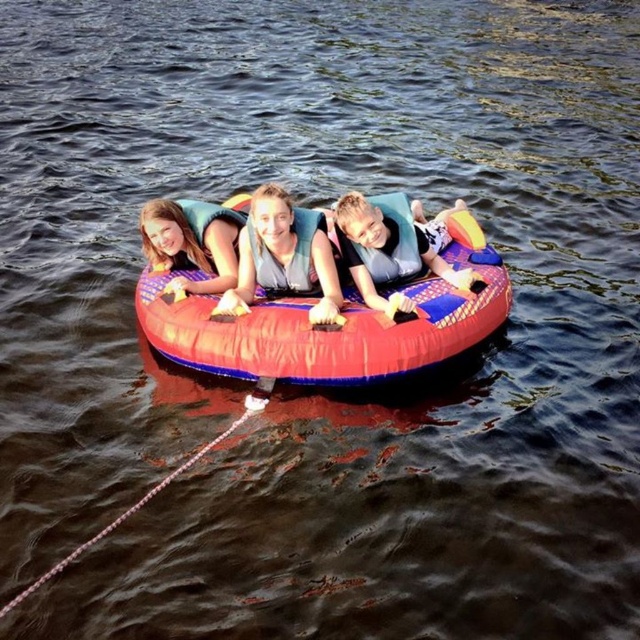
Question: Based on their relative distances, which object is nearer to the matte gray life vest at center?

Choices:
 (A) black matte life jacket at center
 (B) rubberized red tube at center

Answer: (B)

Question: Is the position of matte blue life vest at center less distant than that of black matte life jacket at center?

Choices:
 (A) yes
 (B) no

Answer: (A)

Question: Which object is farther from the camera taking this photo?

Choices:
 (A) black matte life jacket at center
 (B) rubberized red tube at center

Answer: (A)

Question: Is rubberized red tube at center positioned behind matte blue life vest at center?

Choices:
 (A) no
 (B) yes

Answer: (A)

Question: Is rubberized red tube at center bigger than black matte life jacket at center?

Choices:
 (A) yes
 (B) no

Answer: (A)

Question: Which is nearer to the matte gray life vest at center?

Choices:
 (A) rubberized red tube at center
 (B) matte blue life vest at center
 (C) black matte life jacket at center

Answer: (A)